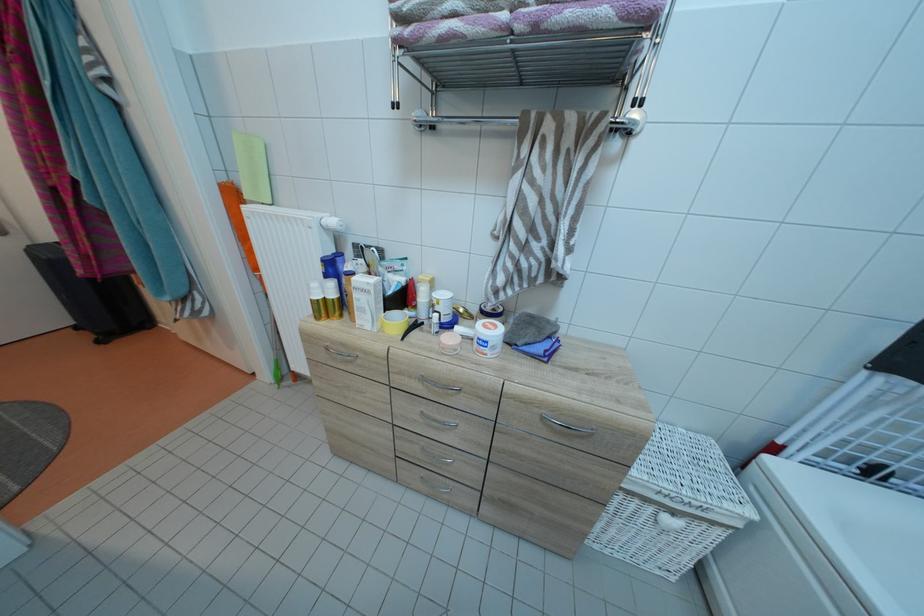
The image size is (924, 616). What do you see at coordinates (276, 373) in the screenshot? I see `the orange broom handle` at bounding box center [276, 373].